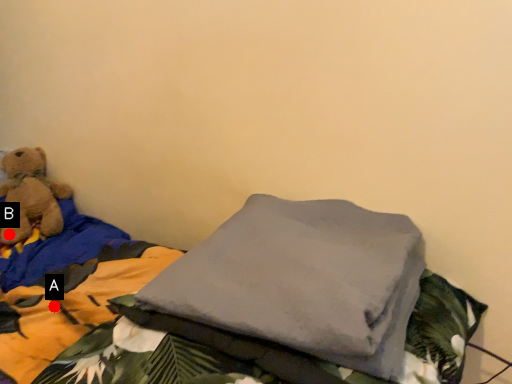
Question: Two points are circled on the image, labeled by A and B beside each circle. Which point is farther to the camera?

Choices:
 (A) A is further
 (B) B is further

Answer: (B)